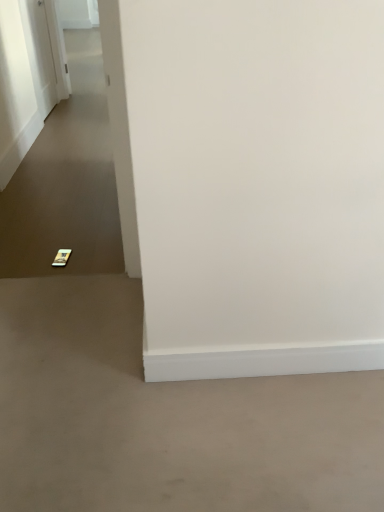
What is the approximate height of gray matte concrete at lower left?

gray matte concrete at lower left is 1.73 inches in height.

What do you see at coordinates (64, 196) in the screenshot? I see `gold metallic phone at lower left` at bounding box center [64, 196].

Locate an element on the screen. The height and width of the screenshot is (512, 384). white glossy door at upper left is located at coordinates (48, 52).

Find the location of a particular element. Image resolution: width=384 pixels, height=512 pixels. gray matte concrete at lower left is located at coordinates [166, 418].

How far apart are white glossy door at upper left and gray matte concrete at lower left?

The distance of white glossy door at upper left from gray matte concrete at lower left is 3.46 meters.

From a real-world perspective, is white glossy door at upper left physically above gray matte concrete at lower left?

Yes, from a real-world perspective, white glossy door at upper left is above gray matte concrete at lower left.

Considering the sizes of objects white glossy door at upper left and gray matte concrete at lower left in the image provided, who is wider, white glossy door at upper left or gray matte concrete at lower left?

Wider between the two is gray matte concrete at lower left.

From a real-world perspective, which object stands above the other?

In real-world perspective, white glossy door at upper left is above.

Is white glossy door at upper left looking in the opposite direction of gold metallic phone at lower left?

No, white glossy door at upper left is not facing the opposite direction of gold metallic phone at lower left.

Who is taller, white glossy door at upper left or gold metallic phone at lower left?

With more height is white glossy door at upper left.

Looking at this image, is white glossy door at upper left wider than gold metallic phone at lower left?

No, white glossy door at upper left is not wider than gold metallic phone at lower left.

Is gold metallic phone at lower left turned away from gray matte concrete at lower left?

That's not correct — gold metallic phone at lower left is not looking away from gray matte concrete at lower left.

Which of these two, gold metallic phone at lower left or gray matte concrete at lower left, stands taller?

Standing taller between the two is gray matte concrete at lower left.

Can you confirm if gold metallic phone at lower left is wider than gray matte concrete at lower left?

Correct, the width of gold metallic phone at lower left exceeds that of gray matte concrete at lower left.

Is gold metallic phone at lower left wider or thinner than white glossy door at upper left?

gold metallic phone at lower left is wider than white glossy door at upper left.

Can you confirm if gold metallic phone at lower left is positioned to the left of white glossy door at upper left?

In fact, gold metallic phone at lower left is to the right of white glossy door at upper left.

Considering the sizes of objects gold metallic phone at lower left and white glossy door at upper left in the image provided, who is taller, gold metallic phone at lower left or white glossy door at upper left?

white glossy door at upper left.

Does gold metallic phone at lower left come in front of white glossy door at upper left?

Yes, the depth of gold metallic phone at lower left is less than that of white glossy door at upper left.

Looking at this image, which object is further away from the camera, gray matte concrete at lower left or gold metallic phone at lower left?

gold metallic phone at lower left is more distant.

In terms of width, does gray matte concrete at lower left look wider or thinner when compared to gold metallic phone at lower left?

Considering their sizes, gray matte concrete at lower left looks slimmer than gold metallic phone at lower left.

Does gray matte concrete at lower left touch gold metallic phone at lower left?

gray matte concrete at lower left and gold metallic phone at lower left are clearly separated.

Find the location of a particular element. path behind the gray matte concrete at lower left is located at coordinates (64, 196).

Which is farther from the camera, (82,464) or (42,96)?

The point (42,96) is farther.

From a real-world perspective, between gray matte concrete at lower left and white glossy door at upper left, who is vertically lower?

gray matte concrete at lower left is physically lower.

Which is more to the right, gray matte concrete at lower left or white glossy door at upper left?

gray matte concrete at lower left.

From the image's perspective, relative to white glossy door at upper left, is gray matte concrete at lower left above or below?

From the image's perspective, gray matte concrete at lower left appears below white glossy door at upper left.

The height and width of the screenshot is (512, 384). I want to click on door that is behind the gray matte concrete at lower left, so click(x=48, y=52).

The image size is (384, 512). I want to click on path on the right of white glossy door at upper left, so click(64, 196).

Considering their positions, is gold metallic phone at lower left positioned further to white glossy door at upper left than gray matte concrete at lower left?

Among the two, gray matte concrete at lower left is located further to white glossy door at upper left.

Estimate the real-world distances between objects in this image. Which object is closer to gold metallic phone at lower left, gray matte concrete at lower left or white glossy door at upper left?

Based on the image, white glossy door at upper left appears to be nearer to gold metallic phone at lower left.

Based on their spatial positions, is white glossy door at upper left or gray matte concrete at lower left closer to gold metallic phone at lower left?

Based on the image, white glossy door at upper left appears to be nearer to gold metallic phone at lower left.

When comparing their distances from gray matte concrete at lower left, does gold metallic phone at lower left or white glossy door at upper left seem closer?

gold metallic phone at lower left is positioned closer to the anchor gray matte concrete at lower left.

Which object lies further to the anchor point gray matte concrete at lower left, white glossy door at upper left or gold metallic phone at lower left?

Based on the image, white glossy door at upper left appears to be further to gray matte concrete at lower left.

When comparing their distances from white glossy door at upper left, does gray matte concrete at lower left or gold metallic phone at lower left seem further?

Among the two, gray matte concrete at lower left is located further to white glossy door at upper left.

What are the coordinates of `path between gray matte concrete at lower left and white glossy door at upper left along the z-axis` in the screenshot? It's located at click(x=64, y=196).